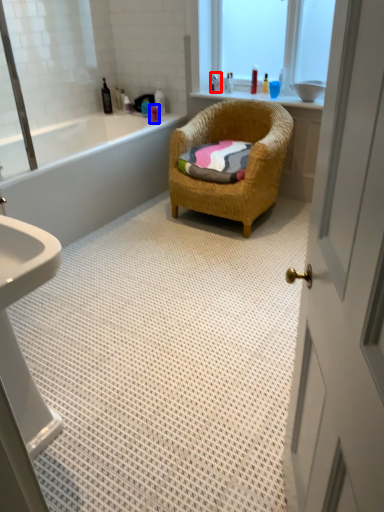
Question: Which object is further to the camera taking this photo, toiletry (highlighted by a red box) or toiletry (highlighted by a blue box)?

Choices:
 (A) toiletry
 (B) toiletry

Answer: (A)